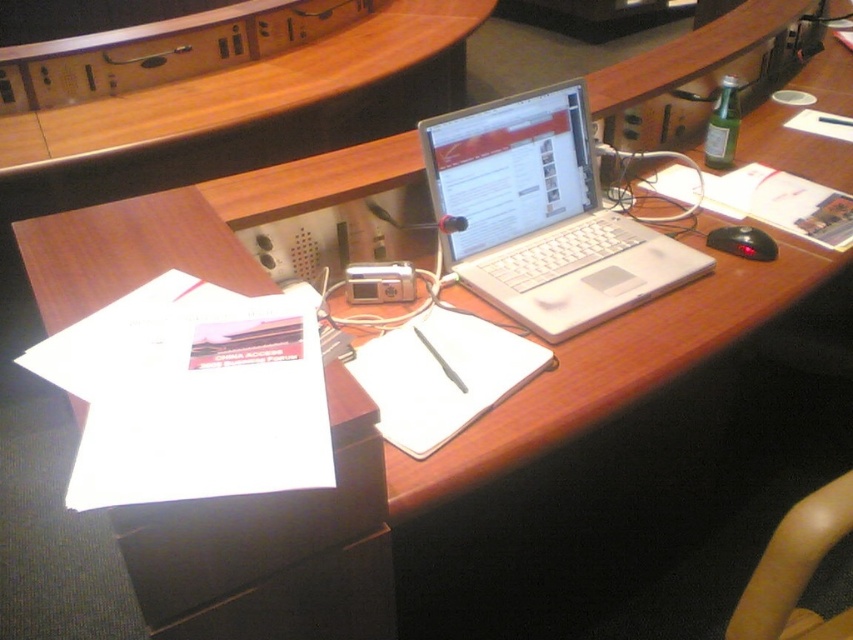
How much distance is there between white paper at lower left and wooden at center?

white paper at lower left is 1.58 meters from wooden at center.

Is white paper at lower left taller than wooden at center?

In fact, white paper at lower left may be shorter than wooden at center.

Between point (206, 397) and point (346, 60), which one is positioned in front?

Positioned in front is point (206, 397).

At what (x,y) coordinates should I click in order to perform the action: click on white paper at lower left. Please return your answer as a coordinate pair (x, y). Looking at the image, I should click on (190, 394).

Which of these two, smooth beige armrest at lower right or black plastic mouse at lower right, stands taller?

With more height is smooth beige armrest at lower right.

Between point (776, 620) and point (722, 228), which one is positioned in front?

Point (776, 620) is in front.

Locate an element on the screen. This screenshot has width=853, height=640. smooth beige armrest at lower right is located at coordinates (796, 570).

Can you confirm if silver metallic laptop at center is positioned to the left of black plastic mouse at lower right?

Correct, you'll find silver metallic laptop at center to the left of black plastic mouse at lower right.

Between silver metallic laptop at center and black plastic mouse at lower right, which one appears on the left side from the viewer's perspective?

silver metallic laptop at center is more to the left.

Describe the element at coordinates (543, 216) in the screenshot. Image resolution: width=853 pixels, height=640 pixels. I see `silver metallic laptop at center` at that location.

Locate an element on the screen. The image size is (853, 640). silver metallic laptop at center is located at coordinates (543, 216).